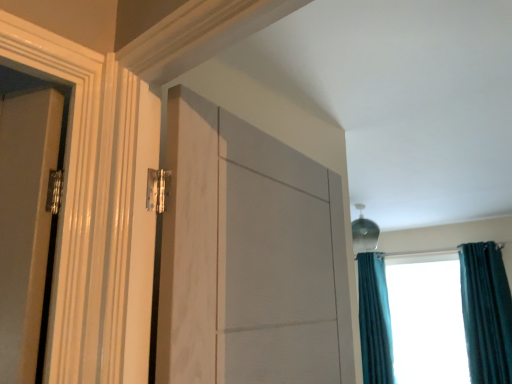
Question: Would you say teal velvet curtain at right, the first curtain viewed from the right, is part of teal curtain at right's contents?

Choices:
 (A) no
 (B) yes

Answer: (A)

Question: Is teal curtain at right directly adjacent to teal velvet curtain at right, which appears as the second curtain when viewed from the back?

Choices:
 (A) no
 (B) yes

Answer: (B)

Question: Is teal curtain at right looking in the opposite direction of teal velvet curtain at right, marked as the second curtain in a left-to-right arrangement?

Choices:
 (A) yes
 (B) no

Answer: (B)

Question: Does teal curtain at right have a smaller size compared to teal velvet curtain at right, which is the first curtain in front-to-back order?

Choices:
 (A) no
 (B) yes

Answer: (A)

Question: Is teal curtain at right further to the viewer compared to teal velvet curtain at right, which appears as the second curtain when viewed from the back?

Choices:
 (A) yes
 (B) no

Answer: (A)

Question: Looking at their shapes, would you say white marble door at center is wider or thinner than teal velvet curtain at right, marked as the second curtain in a left-to-right arrangement?

Choices:
 (A) thin
 (B) wide

Answer: (A)

Question: Is white marble door at center spatially inside teal velvet curtain at right, which is the first curtain in front-to-back order, or outside of it?

Choices:
 (A) inside
 (B) outside

Answer: (B)

Question: Visually, is white marble door at center positioned to the left or to the right of teal velvet curtain at right, which is the first curtain in front-to-back order?

Choices:
 (A) left
 (B) right

Answer: (A)

Question: Considering the positions of white marble door at center and teal velvet curtain at right, which is the first curtain in front-to-back order, in the image, is white marble door at center bigger or smaller than teal velvet curtain at right, which is the first curtain in front-to-back order,?

Choices:
 (A) big
 (B) small

Answer: (B)

Question: From the image's perspective, is teal velvet curtain at right, which is the second curtain from front to back, above or below white marble door at center?

Choices:
 (A) above
 (B) below

Answer: (B)

Question: Based on their positions, is teal velvet curtain at right, which is the first curtain in back-to-front order, located to the left or right of white marble door at center?

Choices:
 (A) right
 (B) left

Answer: (A)

Question: Looking at the image, does teal velvet curtain at right, which is the first curtain in back-to-front order, seem bigger or smaller compared to white marble door at center?

Choices:
 (A) big
 (B) small

Answer: (A)

Question: Looking at their shapes, would you say teal velvet curtain at right, marked as the second curtain in a right-to-left arrangement, is wider or thinner than white marble door at center?

Choices:
 (A) wide
 (B) thin

Answer: (A)

Question: Does point (298, 259) appear closer or farther from the camera than point (375, 370)?

Choices:
 (A) farther
 (B) closer

Answer: (B)

Question: In the image, is white marble door at center on the left side or the right side of teal velvet curtain at right, the 1th curtain when ordered from left to right?

Choices:
 (A) left
 (B) right

Answer: (A)